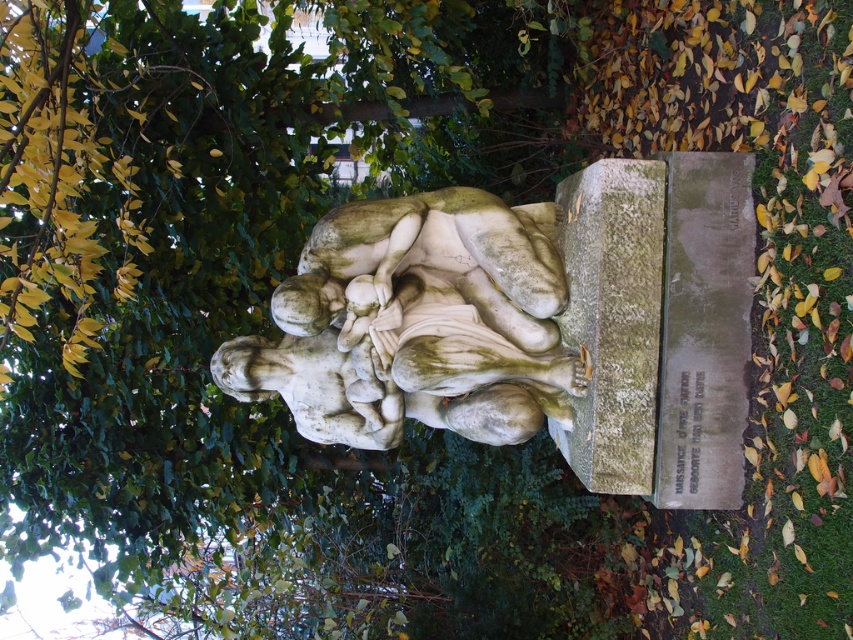
Question: Is white marble statue at center thinner than green mossy stone at center?

Choices:
 (A) no
 (B) yes

Answer: (A)

Question: Is white marble statue at center thinner than green mossy stone at center?

Choices:
 (A) no
 (B) yes

Answer: (A)

Question: Considering the relative positions of white marble statue at center and green mossy stone at center in the image provided, where is white marble statue at center located with respect to green mossy stone at center?

Choices:
 (A) left
 (B) right

Answer: (A)